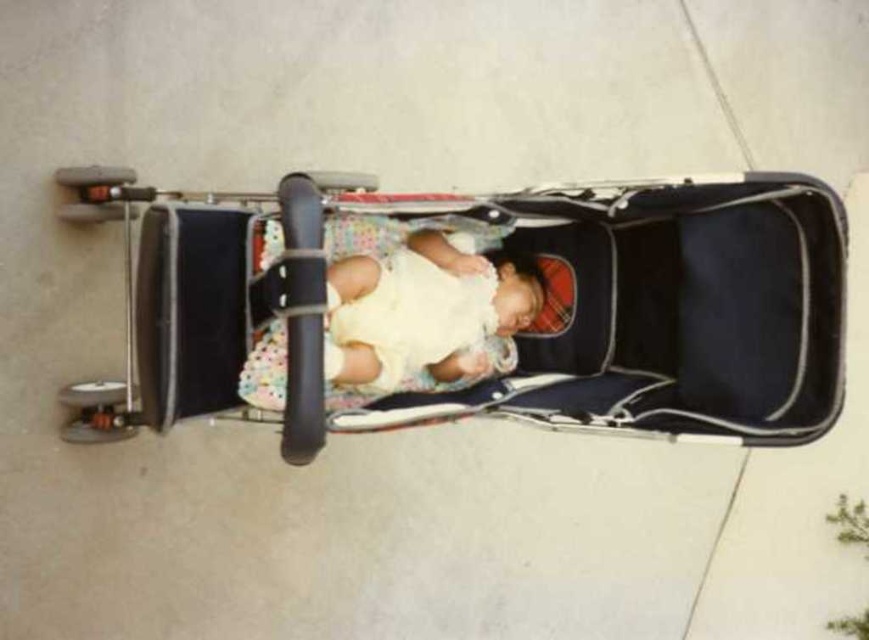
Question: Is black fabric baby carriage at center further to camera compared to soft yellow fabric baby at center?

Choices:
 (A) yes
 (B) no

Answer: (B)

Question: Is black fabric baby carriage at center bigger than soft yellow fabric baby at center?

Choices:
 (A) no
 (B) yes

Answer: (B)

Question: Which of the following is the closest to the observer?

Choices:
 (A) (198, 292)
 (B) (481, 316)

Answer: (A)

Question: From the image, what is the correct spatial relationship of black fabric baby carriage at center in relation to soft yellow fabric baby at center?

Choices:
 (A) left
 (B) right

Answer: (B)